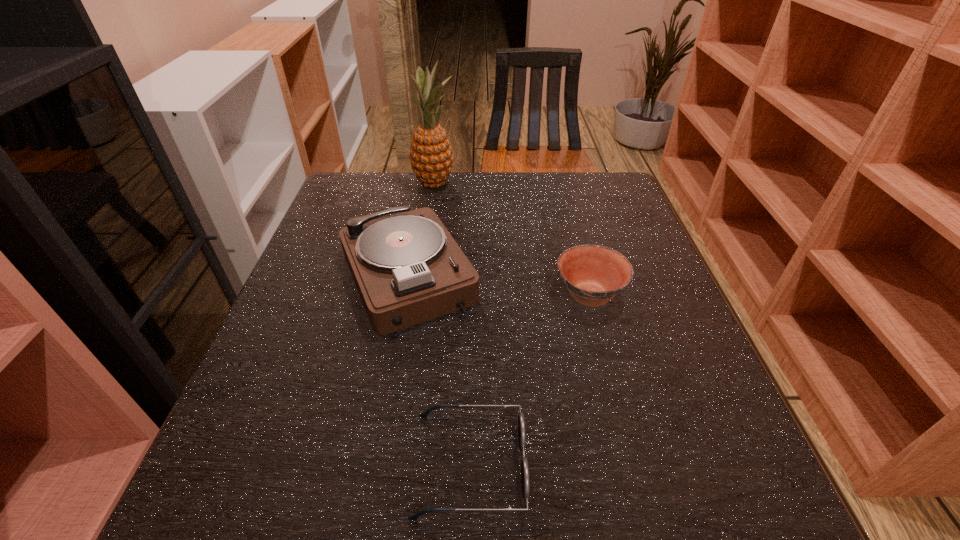
At what (x,y) coordinates should I click in order to perform the action: click on the tallest object. Please return your answer as a coordinate pair (x, y). Looking at the image, I should click on (431, 158).

Locate an element on the screen. pineapple is located at coordinates (431, 158).

Where is `record player`? The width and height of the screenshot is (960, 540). record player is located at coordinates pos(408,269).

This screenshot has height=540, width=960. I want to click on the rightmost object, so click(594, 274).

This screenshot has width=960, height=540. What are the coordinates of `bowl` in the screenshot? It's located at (594, 274).

Locate an element on the screen. Image resolution: width=960 pixels, height=540 pixels. the nearest object is located at coordinates (521, 421).

Where is `sunglasses`? sunglasses is located at coordinates (521, 421).

The width and height of the screenshot is (960, 540). I want to click on free spot located on the right of the tallest object, so click(491, 184).

Where is `vacant space situated 0.300m on the front of the record player`? The image size is (960, 540). vacant space situated 0.300m on the front of the record player is located at coordinates (369, 500).

Where is `free space located 0.250m on the front of the second shortest object`? free space located 0.250m on the front of the second shortest object is located at coordinates (627, 438).